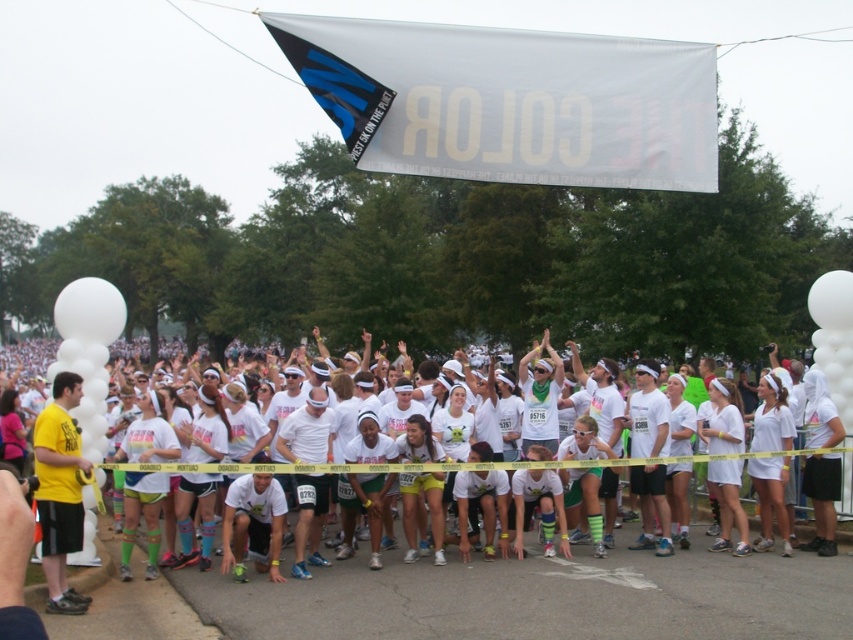
You are a photographer at the event and want to capture a photo that includes both the white fabric banner at upper center and the yellow matte shirt at left. Based on their positions, which object should appear higher in the photo?

The white fabric banner at upper center should appear higher in the photo because it is positioned above the yellow matte shirt at left.

You are a photographer at the Color Run event. You want to capture a photo of the crowd while ensuring the white fabric banner at upper center is visible in the background. Based on its position, where should you position yourself relative to the crowd to include the banner?

The white fabric banner at upper center is located at point (509, 102), so you should position yourself centrally to ensure the banner is visible in the background.

You are a photographer standing at the starting line of the color run event. You want to capture a photo of the white fabric banner at upper center. Given that your camera has a maximum focus range of 10 meters, will you be able to capture the banner clearly?

The white fabric banner at upper center is 11.69 meters away from the viewer. Since the camera can only focus up to 10 meters, it won provided range. You may need to move closer or use a different camera with a longer focus range.